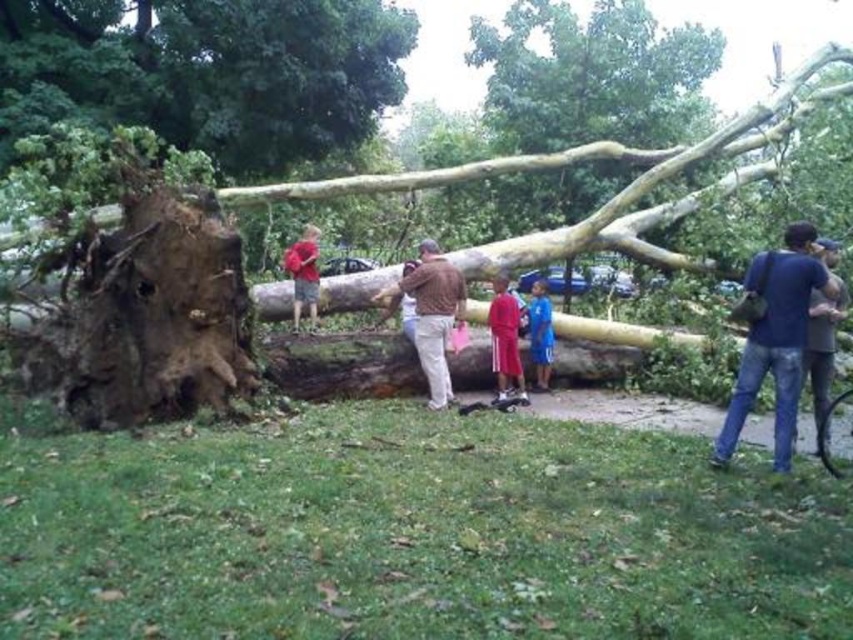
Between point (758, 365) and point (287, 250), which one is positioned behind?

The point (287, 250) is behind.

The height and width of the screenshot is (640, 853). Find the location of `dark blue jeans at lower right`. dark blue jeans at lower right is located at coordinates (775, 337).

Which is behind, point (793, 304) or point (314, 232)?

The point (314, 232) is more distant.

Identify the location of dark blue jeans at lower right. (775, 337).

Between brown textured shirt at center and matte red shirt at center, which one has more height?

brown textured shirt at center

Which is behind, point (421, 339) or point (294, 248)?

Positioned behind is point (294, 248).

Is point (403, 276) closer to viewer compared to point (299, 248)?

Yes, point (403, 276) is in front of point (299, 248).

At what (x,y) coordinates should I click in order to perform the action: click on brown textured shirt at center. Please return your answer as a coordinate pair (x, y). Looking at the image, I should click on (432, 314).

Is brown textured shirt at center to the left of matte red shorts at center from the viewer's perspective?

Indeed, brown textured shirt at center is positioned on the left side of matte red shorts at center.

Which is in front, point (440, 337) or point (502, 282)?

Positioned in front is point (440, 337).

You are a GUI agent. You are given a task and a screenshot of the screen. Output one action in this format:
    pyautogui.click(x=<x>, y=<y>)
    Task: Click on the brown textured shirt at center
    This screenshot has height=640, width=853.
    Given the screenshot: What is the action you would take?
    pyautogui.click(x=432, y=314)